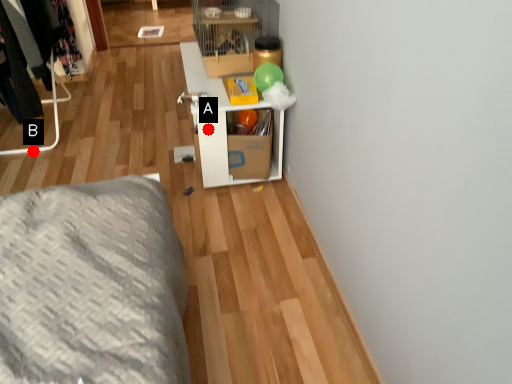
Question: Two points are circled on the image, labeled by A and B beside each circle. Which point is closer to the camera?

Choices:
 (A) A is closer
 (B) B is closer

Answer: (A)